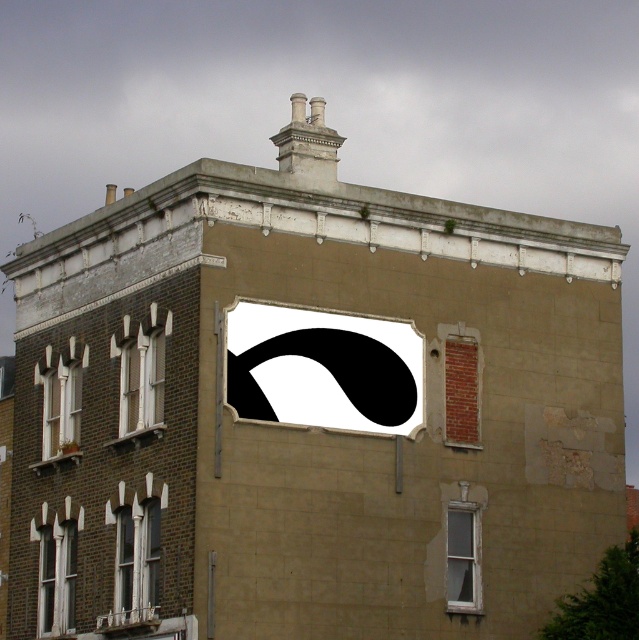
The height and width of the screenshot is (640, 639). Describe the element at coordinates (56, 577) in the screenshot. I see `matte white window at lower left` at that location.

Between matte white window at lower left and clear glass window at lower right, which one appears on the right side from the viewer's perspective?

Positioned to the right is clear glass window at lower right.

Which is behind, point (56, 554) or point (477, 544)?

Positioned behind is point (56, 554).

Find the location of `matte white window at lower left`. matte white window at lower left is located at coordinates (56, 577).

Who is higher up, white painted wood at left or white painted wood window at left?

white painted wood at left is higher up.

Which is below, white painted wood at left or white painted wood window at left?

Positioned lower is white painted wood window at left.

Between point (132, 368) and point (43, 456), which one is positioned in front?

Point (132, 368) is more forward.

Where is `white painted wood at left`? The width and height of the screenshot is (639, 640). white painted wood at left is located at coordinates (141, 371).

Who is more distant from viewer, (344, 333) or (134, 376)?

Point (134, 376)

Describe the element at coordinates (323, 369) in the screenshot. I see `black matte hole at center` at that location.

Which is behind, point (390, 371) or point (127, 372)?

The point (127, 372) is more distant.

Locate an element on the screen. black matte hole at center is located at coordinates (323, 369).